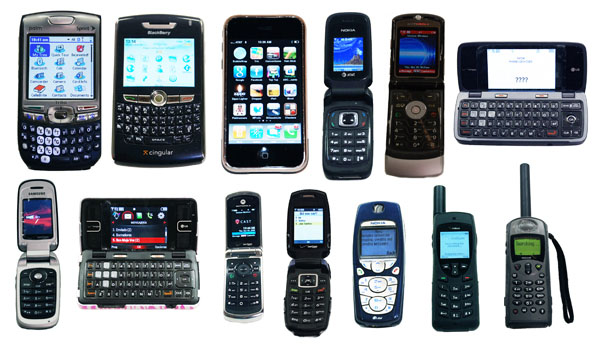
Identify the location of bright screen. (64, 67), (166, 65), (278, 90), (349, 41), (515, 65), (311, 222), (460, 248).